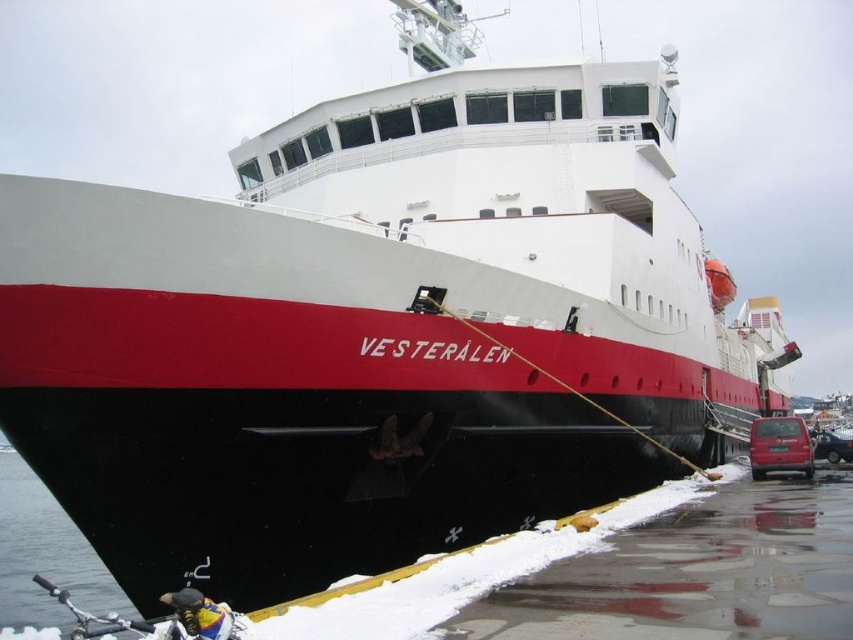
Is matte red van at lower right bigger than metallic silver car at lower right?

No.

Does matte red van at lower right lie in front of metallic silver car at lower right?

Yes, matte red van at lower right is in front of metallic silver car at lower right.

Does point (793, 419) come in front of point (819, 458)?

Yes, point (793, 419) is closer to viewer.

This screenshot has height=640, width=853. I want to click on matte red van at lower right, so click(x=779, y=445).